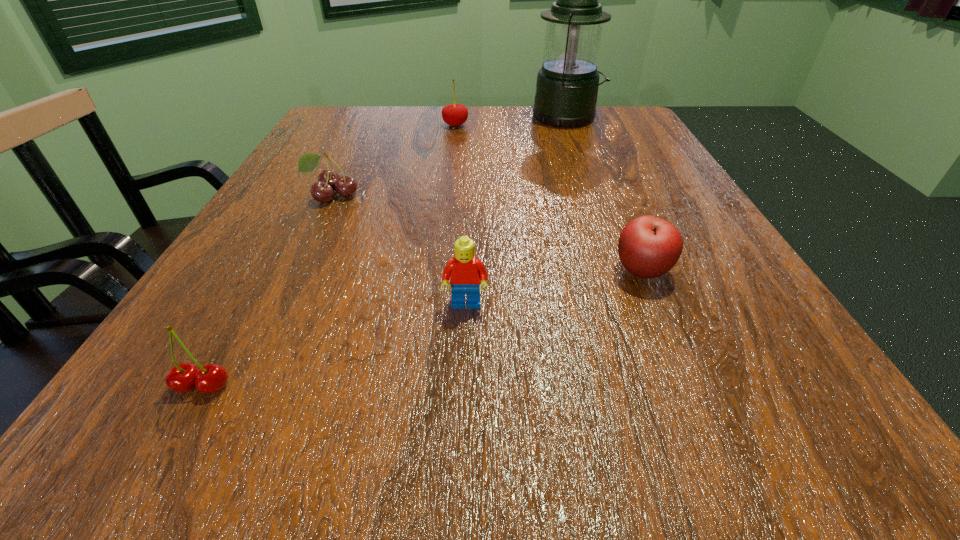
Find the location of `unoccupied area between the apple and the lantern`. unoccupied area between the apple and the lantern is located at coordinates (604, 194).

Where is `empty space between the second nearest object and the third farthest object`? empty space between the second nearest object and the third farthest object is located at coordinates (398, 251).

I want to click on vacant space that's between the fourth nearest object and the farthest cherry, so click(394, 160).

Locate an element on the screen. vacant space that's between the apple and the nearest cherry is located at coordinates (422, 328).

Where is `vacant area that lies between the fifth farthest object and the tallest object`? vacant area that lies between the fifth farthest object and the tallest object is located at coordinates (516, 212).

Identify which object is the nearest to the nearest object. Please provide its 2D coordinates. Your answer should be formatted as a tuple, i.e. [(x, y)], where the tuple contains the x and y coordinates of a point satisfying the conditions above.

[(464, 271)]

Locate which object ranks fifth in proximity to the lantern. Please provide its 2D coordinates. Your answer should be formatted as a tuple, i.e. [(x, y)], where the tuple contains the x and y coordinates of a point satisfying the conditions above.

[(211, 378)]

Identify which cherry is the nearest to the third farthest object. Please provide its 2D coordinates. Your answer should be formatted as a tuple, i.e. [(x, y)], where the tuple contains the x and y coordinates of a point satisfying the conditions above.

[(454, 114)]

This screenshot has height=540, width=960. Find the location of `cherry that stands as the second closest to the fourth nearest object`. cherry that stands as the second closest to the fourth nearest object is located at coordinates (211, 378).

Locate an element on the screen. The width and height of the screenshot is (960, 540). vacant region that satisfies the following two spatial constraints: 1. on the leaves of the third farthest object; 2. on the left side of the apple is located at coordinates 295,271.